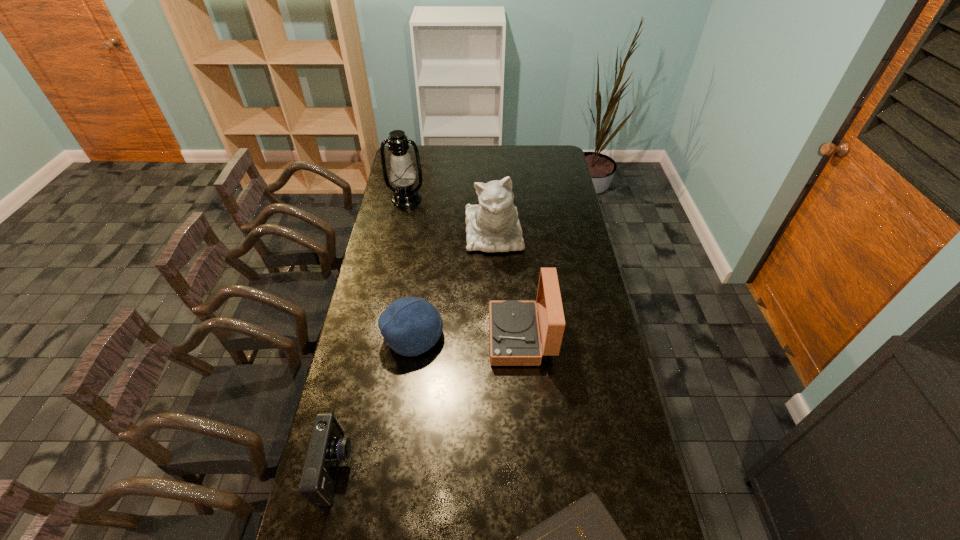
The height and width of the screenshot is (540, 960). I want to click on cat, so click(x=492, y=226).

The width and height of the screenshot is (960, 540). What are the coordinates of `the farthest object` in the screenshot? It's located at pyautogui.click(x=402, y=174).

Identify the location of phonograph record. The width and height of the screenshot is (960, 540). (514, 336).

Locate an element on the screen. This screenshot has height=540, width=960. skullcap is located at coordinates (410, 326).

At what (x,y) coordinates should I click in order to perform the action: click on the second shortest object. Please return your answer as a coordinate pair (x, y). The height and width of the screenshot is (540, 960). Looking at the image, I should click on (327, 447).

Where is `free region located 0.300m on the front-facing side of the second farthest object`? free region located 0.300m on the front-facing side of the second farthest object is located at coordinates point(496,318).

This screenshot has height=540, width=960. I want to click on free space located 0.240m on the right of the farthest object, so click(x=473, y=199).

Where is `vacant region located 0.290m on the face of the phonograph record`? Image resolution: width=960 pixels, height=540 pixels. vacant region located 0.290m on the face of the phonograph record is located at coordinates (409, 338).

Where is `vacant space situated 0.300m on the face of the phonograph record`? vacant space situated 0.300m on the face of the phonograph record is located at coordinates (406, 338).

Locate an element on the screen. This screenshot has width=960, height=540. vacant area situated 0.290m on the face of the phonograph record is located at coordinates (409, 338).